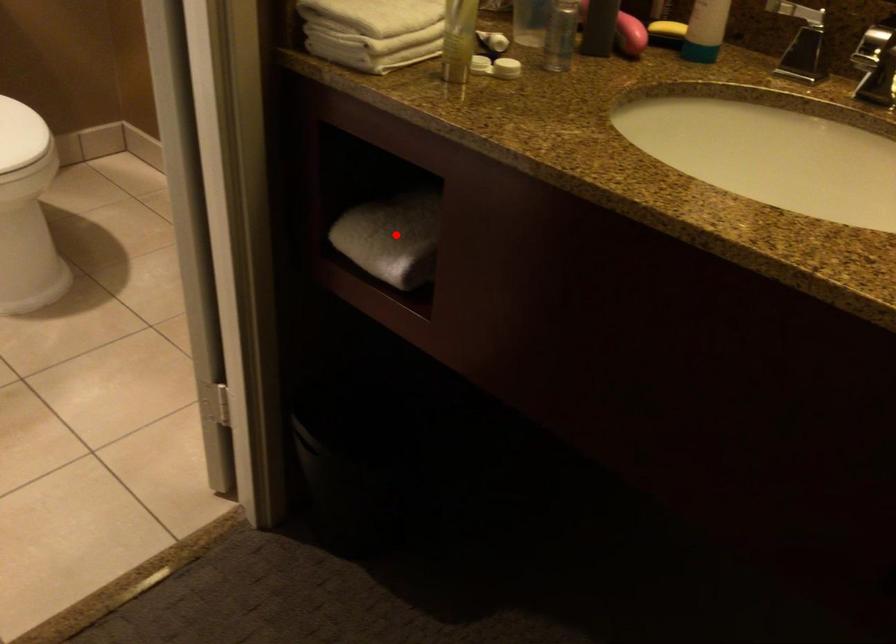
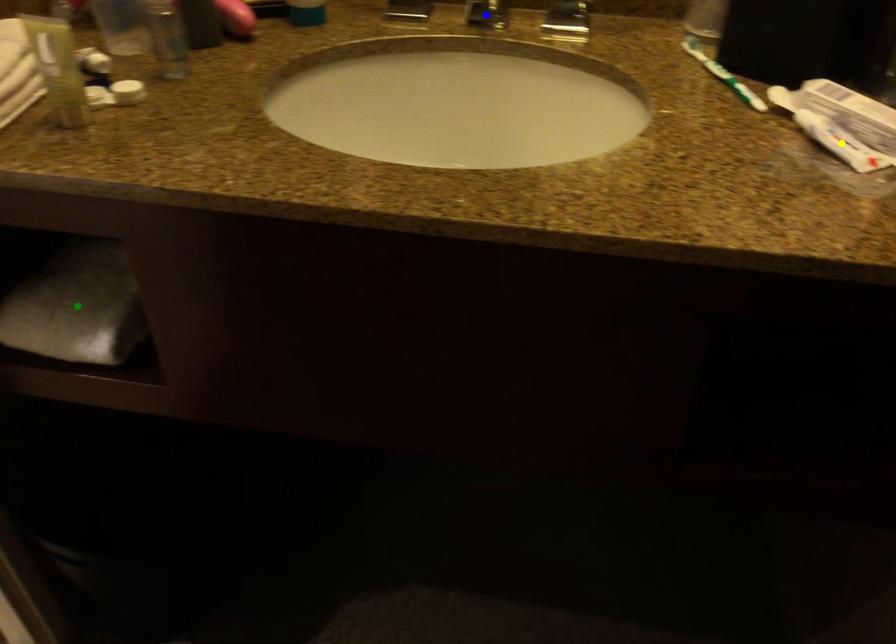
Question: I am providing you with two images of the same scene from different viewpoints. A red point is marked on the first image. You are given multiple points on the second image. Which mark in image 2 goes with the point in image 1?

Choices:
 (A) blue point
 (B) green point
 (C) yellow point

Answer: (B)